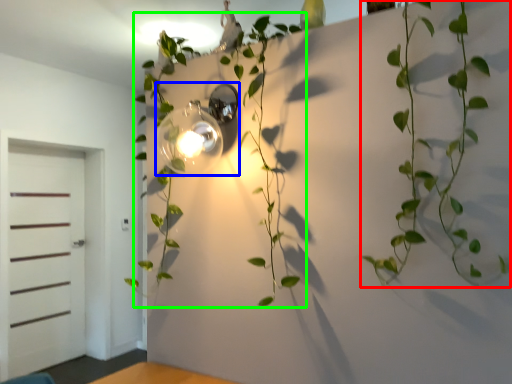
Question: Based on their relative distances, which object is farther from houseplant (highlighted by a red box)? Choose from light fixture (highlighted by a blue box) and plant (highlighted by a green box).

Choices:
 (A) light fixture
 (B) plant

Answer: (A)